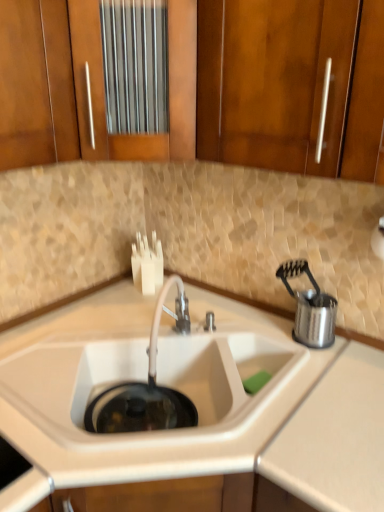
Where is `vacant point to the left of stainless steel utensil holder at right`? The height and width of the screenshot is (512, 384). vacant point to the left of stainless steel utensil holder at right is located at coordinates (252, 326).